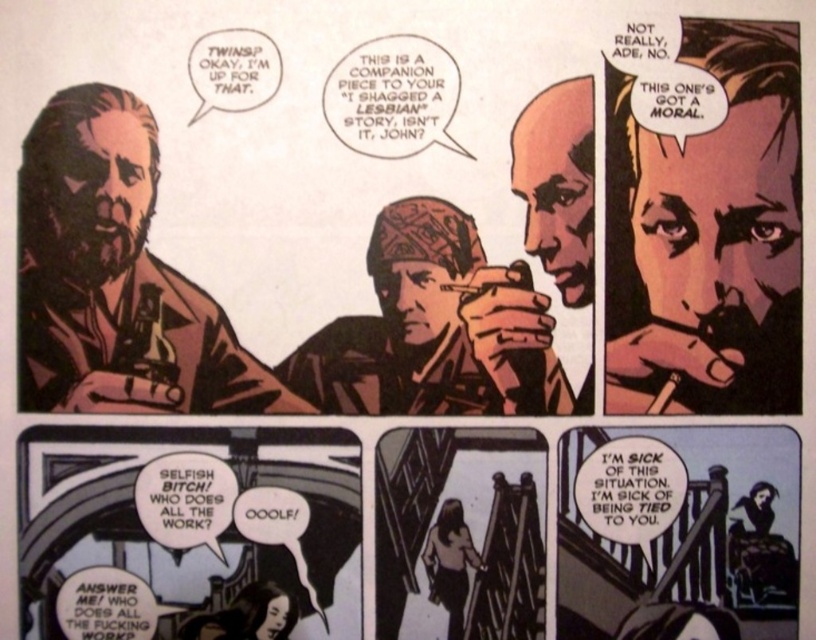
Can you confirm if smooth wooden pipe at upper right is smaller than matte brown bandana at center?

No, smooth wooden pipe at upper right is not smaller than matte brown bandana at center.

Does smooth wooden pipe at upper right lie in front of matte brown bandana at center?

Yes.

This screenshot has width=816, height=640. What do you see at coordinates (708, 236) in the screenshot? I see `smooth wooden pipe at upper right` at bounding box center [708, 236].

I want to click on smooth wooden pipe at upper right, so click(708, 236).

From the picture: Is matte brown bandana at center positioned in front of smooth skin face at upper right?

Answer: No, matte brown bandana at center is behind smooth skin face at upper right.

Between matte brown bandana at center and smooth skin face at upper right, which one is positioned lower?

matte brown bandana at center is below.

The width and height of the screenshot is (816, 640). Identify the location of matte brown bandana at center. (435, 328).

The height and width of the screenshot is (640, 816). Find the location of `matte brown leather jacket at left`. matte brown leather jacket at left is located at coordinates (116, 278).

Is point (34, 198) behind point (311, 392)?

No, it is not.

Is point (109, 385) in front of point (497, 376)?

Yes, it is in front of point (497, 376).

Locate an element on the screen. matte brown leather jacket at left is located at coordinates (116, 278).